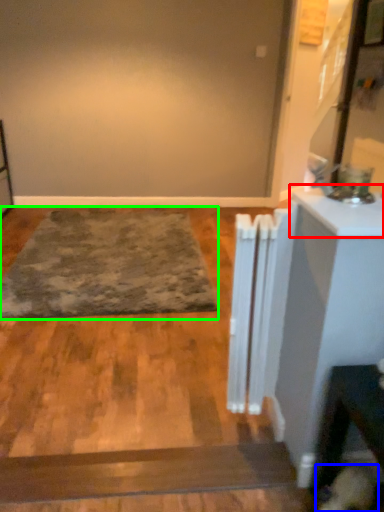
Question: Based on their relative distances, which object is farther from counter top (highlighted by a red box)? Choose from dog (highlighted by a blue box) and mat (highlighted by a green box).

Choices:
 (A) dog
 (B) mat

Answer: (B)